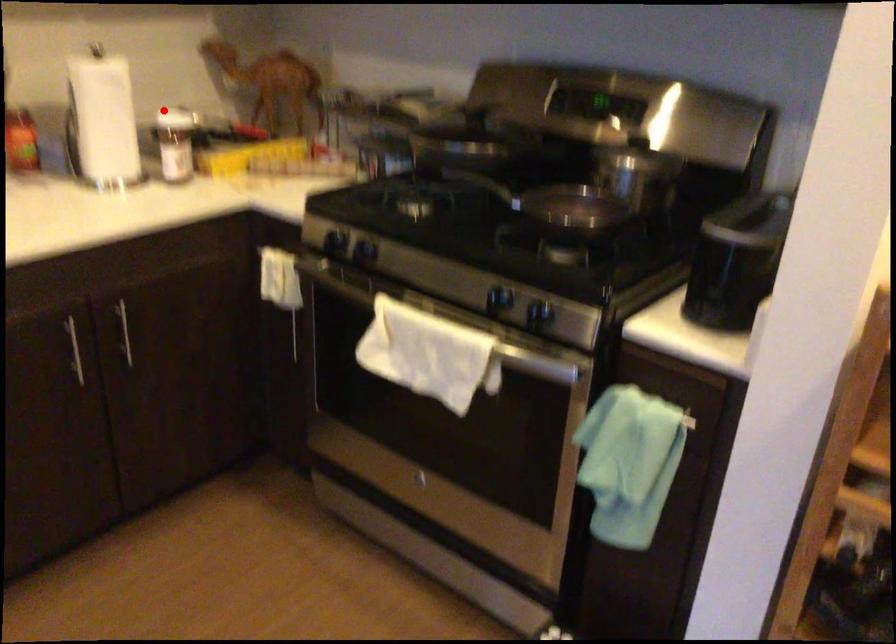
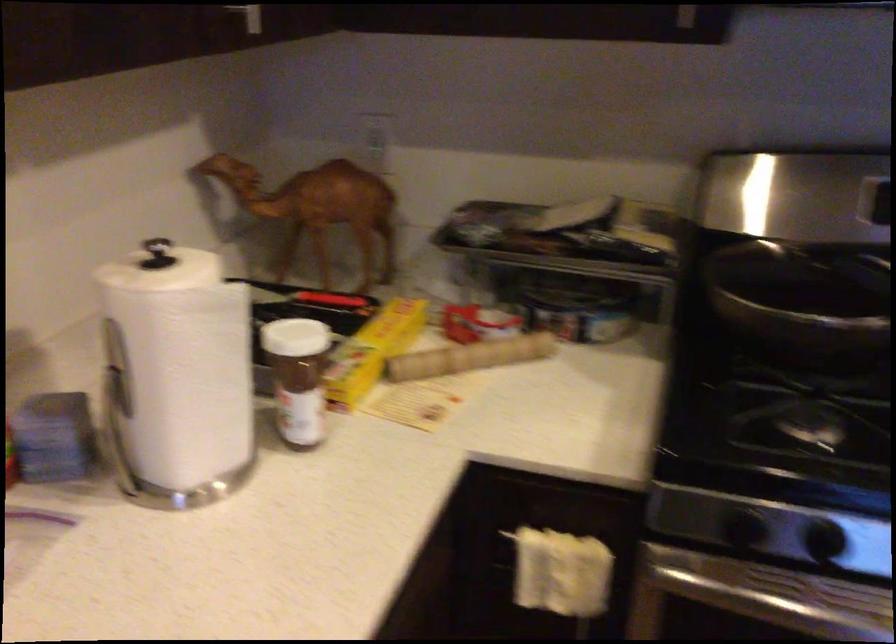
Question: A red point is marked in image1. In image2, is the corresponding 3D point closer to the camera or farther? Reply with the corresponding letter.

Choices:
 (A) The corresponding 3D point is closer.
 (B) The corresponding 3D point is farther.

Answer: (A)